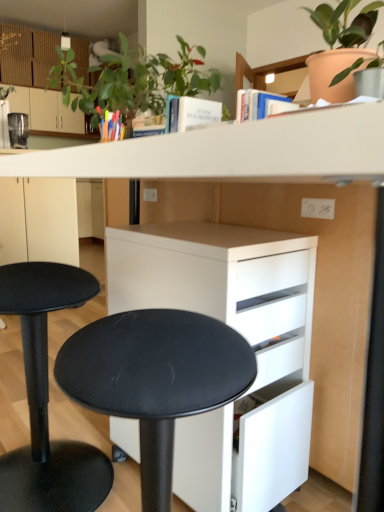
What do you see at coordinates (18, 130) in the screenshot? The height and width of the screenshot is (512, 384). I see `matte black coffee maker at left` at bounding box center [18, 130].

At what (x,y) coordinates should I click in order to perform the action: click on black matte stool at lower left. Please return your answer as a coordinate pair (x, y). This screenshot has width=384, height=512. Looking at the image, I should click on (48, 399).

The height and width of the screenshot is (512, 384). Describe the element at coordinates (244, 337) in the screenshot. I see `white matte cabinet at lower center, acting as the 1th cabinetry starting from the right` at that location.

Describe the element at coordinates (111, 125) in the screenshot. This screenshot has height=512, width=384. I see `translucent plastic pen holder at upper center` at that location.

What is the approximate width of terracotta clay pot at upper right, positioned as the first houseplant in right-to-left order?

terracotta clay pot at upper right, positioned as the first houseplant in right-to-left order, is 12.36 inches wide.

Where is `matte beige cabinet at upper left, which is counted as the first cabinetry, starting from the back`? The image size is (384, 512). matte beige cabinet at upper left, which is counted as the first cabinetry, starting from the back is located at coordinates (46, 110).

I want to click on green leafy plant at upper left, which is the first houseplant from left to right, so click(x=134, y=81).

Where is `matte black coffee maker at left`? matte black coffee maker at left is located at coordinates (18, 130).

Which point is more forward, (188, 289) or (328, 71)?

The point (188, 289) is closer to the camera.

Consider the image. Is white matte cabinet at lower center, the 2th cabinetry viewed from the top, aimed at terracotta clay pot at upper right, which is the second houseplant in left-to-right order?

No, white matte cabinet at lower center, the 2th cabinetry viewed from the top, is not turned towards terracotta clay pot at upper right, which is the second houseplant in left-to-right order.

How different are the orientations of white matte cabinet at lower center, the 2th cabinetry viewed from the top, and terracotta clay pot at upper right, positioned as the first houseplant in right-to-left order, in degrees?

2.97 degrees.

Is white matte cabinet at lower center, acting as the 1th cabinetry starting from the right, wider than terracotta clay pot at upper right, which is the second houseplant in left-to-right order?

Correct, the width of white matte cabinet at lower center, acting as the 1th cabinetry starting from the right, exceeds that of terracotta clay pot at upper right, which is the second houseplant in left-to-right order.

Is matte beige cabinet at upper left, which ranks as the first cabinetry in top-to-bottom order, oriented away from translucent plastic pen holder at upper center?

No, translucent plastic pen holder at upper center is not at the back of matte beige cabinet at upper left, which ranks as the first cabinetry in top-to-bottom order.

Image resolution: width=384 pixels, height=512 pixels. I want to click on cabinetry on the left of translucent plastic pen holder at upper center, so click(x=46, y=110).

Is the depth of matte beige cabinet at upper left, the second cabinetry viewed from the front, less than that of translucent plastic pen holder at upper center?

No, it is not.

Based on the photo, is matte beige cabinet at upper left, which ranks as the first cabinetry in top-to-bottom order, shorter than translucent plastic pen holder at upper center?

→ No.

Considering the sizes of objects white matte cabinet at lower center, the 2th cabinetry positioned from the back, and green leafy plant at upper left, which is the first houseplant from left to right, in the image provided, who is thinner, white matte cabinet at lower center, the 2th cabinetry positioned from the back, or green leafy plant at upper left, which is the first houseplant from left to right,?

With smaller width is green leafy plant at upper left, which is the first houseplant from left to right.

Is white matte cabinet at lower center, acting as the 1th cabinetry starting from the right, to the left of green leafy plant at upper left, which is the first houseplant from left to right, from the viewer's perspective?

Incorrect, white matte cabinet at lower center, acting as the 1th cabinetry starting from the right, is not on the left side of green leafy plant at upper left, which is the first houseplant from left to right.

Is white matte cabinet at lower center, the first cabinetry in the front-to-back sequence, turned away from green leafy plant at upper left, which is counted as the 2th houseplant, starting from the right?

No.

Is matte beige cabinet at upper left, which is the second cabinetry from bottom to top, surrounded by terracotta clay pot at upper right, positioned as the first houseplant in right-to-left order?

No, matte beige cabinet at upper left, which is the second cabinetry from bottom to top, is not surrounded by terracotta clay pot at upper right, positioned as the first houseplant in right-to-left order.

Between terracotta clay pot at upper right, positioned as the first houseplant in right-to-left order, and matte beige cabinet at upper left, which is the second cabinetry from bottom to top, which one is positioned in front?

terracotta clay pot at upper right, positioned as the first houseplant in right-to-left order.

Which of these two, terracotta clay pot at upper right, which is the second houseplant in left-to-right order, or matte beige cabinet at upper left, which ranks as the first cabinetry in left-to-right order, stands taller?

With more height is matte beige cabinet at upper left, which ranks as the first cabinetry in left-to-right order.

From the image's perspective, who appears lower, terracotta clay pot at upper right, positioned as the first houseplant in right-to-left order, or matte beige cabinet at upper left, which is counted as the first cabinetry, starting from the back?

terracotta clay pot at upper right, positioned as the first houseplant in right-to-left order.

Is point (37, 445) closer to viewer compared to point (223, 242)?

No, it is behind (223, 242).

Can you confirm if black matte stool at lower left is positioned to the left of white matte cabinet at lower center, acting as the 1th cabinetry starting from the right?

Yes.

From the image's perspective, does black matte stool at lower left appear higher than white matte cabinet at lower center, acting as the 1th cabinetry starting from the right?

Yes, from the image's perspective, black matte stool at lower left is over white matte cabinet at lower center, acting as the 1th cabinetry starting from the right.

Looking at this image, is black matte stool at lower left located outside white matte cabinet at lower center, the 2th cabinetry viewed from the top?

Indeed, black matte stool at lower left is completely outside white matte cabinet at lower center, the 2th cabinetry viewed from the top.

In terms of size, does white matte cabinet at lower center, the first cabinetry in the front-to-back sequence, appear bigger or smaller than matte black coffee maker at left?

In the image, white matte cabinet at lower center, the first cabinetry in the front-to-back sequence, appears to be larger than matte black coffee maker at left.

Does white matte cabinet at lower center, the first cabinetry in the bottom-to-top sequence, lie behind matte black coffee maker at left?

No, white matte cabinet at lower center, the first cabinetry in the bottom-to-top sequence, is closer to the camera.

Consider the image. Is matte black coffee maker at left completely or partially inside white matte cabinet at lower center, the first cabinetry in the front-to-back sequence?

Definitely not — matte black coffee maker at left is not inside white matte cabinet at lower center, the first cabinetry in the front-to-back sequence.

Which of these two, white matte cabinet at lower center, the 2th cabinetry viewed from the top, or matte black coffee maker at left, is thinner?

Thinner between the two is matte black coffee maker at left.

Is translucent plastic pen holder at upper center turned away from matte black coffee maker at left?

No, translucent plastic pen holder at upper center's orientation is not away from matte black coffee maker at left.

Between translucent plastic pen holder at upper center and matte black coffee maker at left, which one has smaller size?

translucent plastic pen holder at upper center is smaller.

From a real-world perspective, is translucent plastic pen holder at upper center physically below matte black coffee maker at left?

Yes, from a real-world perspective, translucent plastic pen holder at upper center is beneath matte black coffee maker at left.

In the scene shown: Considering the sizes of translucent plastic pen holder at upper center and matte black coffee maker at left in the image, is translucent plastic pen holder at upper center wider or thinner than matte black coffee maker at left?

translucent plastic pen holder at upper center is thinner than matte black coffee maker at left.

From the terracotta clay pot at upper right, which is the second houseplant in left-to-right order, count the 1st cabinetry to the left and point to it. Please provide its 2D coordinates.

[(244, 337)]

At what (x,y) coordinates should I click in order to perform the action: click on cabinetry behind the translucent plastic pen holder at upper center. Please return your answer as a coordinate pair (x, y). This screenshot has height=512, width=384. Looking at the image, I should click on point(46,110).

Looking at the image, which one is located closer to matte beige cabinet at upper left, placed as the 2th cabinetry when sorted from right to left, matte black coffee maker at left or translucent plastic pen holder at upper center?

matte black coffee maker at left lies closer to matte beige cabinet at upper left, placed as the 2th cabinetry when sorted from right to left, than the other object.

Looking at the image, which one is located further to translucent plastic pen holder at upper center, green leafy plant at upper left, which is the first houseplant from left to right, or white matte cabinet at lower center, the first cabinetry in the front-to-back sequence?

Among the two, white matte cabinet at lower center, the first cabinetry in the front-to-back sequence, is located further to translucent plastic pen holder at upper center.

Estimate the real-world distances between objects in this image. Which object is further from black matte stool at lower left, green leafy plant at upper left, which is the first houseplant from left to right, or translucent plastic pen holder at upper center?

Among the two, green leafy plant at upper left, which is the first houseplant from left to right, is located further to black matte stool at lower left.

Considering their positions, is matte black coffee maker at left positioned closer to translucent plastic pen holder at upper center than matte beige cabinet at upper left, which ranks as the first cabinetry in left-to-right order?

matte black coffee maker at left.

When comparing their distances from matte black coffee maker at left, does green leafy plant at upper left, which is counted as the 2th houseplant, starting from the right, or terracotta clay pot at upper right, which is the second houseplant in left-to-right order, seem closer?

The object closer to matte black coffee maker at left is green leafy plant at upper left, which is counted as the 2th houseplant, starting from the right.

Which object lies nearer to the anchor point matte black coffee maker at left, white matte cabinet at lower center, the first cabinetry in the front-to-back sequence, or terracotta clay pot at upper right, which is the second houseplant in left-to-right order?

terracotta clay pot at upper right, which is the second houseplant in left-to-right order.

Based on their spatial positions, is black matte stool at lower left or white matte cabinet at lower center, positioned as the second cabinetry in left-to-right order, closer to terracotta clay pot at upper right, positioned as the first houseplant in right-to-left order?

Based on the image, white matte cabinet at lower center, positioned as the second cabinetry in left-to-right order, appears to be nearer to terracotta clay pot at upper right, positioned as the first houseplant in right-to-left order.

Which object lies further to the anchor point white matte cabinet at lower center, the 2th cabinetry viewed from the top, matte black coffee maker at left or green leafy plant at upper left, which is the first houseplant from left to right?

matte black coffee maker at left is further to white matte cabinet at lower center, the 2th cabinetry viewed from the top.

Locate an element on the screen. stool that lies between green leafy plant at upper left, which is the first houseplant from left to right, and white matte cabinet at lower center, the 2th cabinetry viewed from the top, from top to bottom is located at coordinates (48, 399).

You are a GUI agent. You are given a task and a screenshot of the screen. Output one action in this format:
    pyautogui.click(x=<x>, y=<y>)
    Task: Click on the book between black matte stool at lower left and matte beige cabinet at upper left, which ranks as the first cabinetry in top-to-bottom order, along the z-axis
    The width and height of the screenshot is (384, 512).
    Given the screenshot: What is the action you would take?
    [111, 125]

Where is `book between terracotta clay pot at upper right, which is the second houseplant in left-to-right order, and white matte cabinet at lower center, positioned as the second cabinetry in left-to-right order, in the vertical direction`? This screenshot has width=384, height=512. book between terracotta clay pot at upper right, which is the second houseplant in left-to-right order, and white matte cabinet at lower center, positioned as the second cabinetry in left-to-right order, in the vertical direction is located at coordinates (111, 125).

The image size is (384, 512). In order to click on houseplant between terracotta clay pot at upper right, which is the second houseplant in left-to-right order, and matte black coffee maker at left, along the z-axis in this screenshot , I will do `click(134, 81)`.